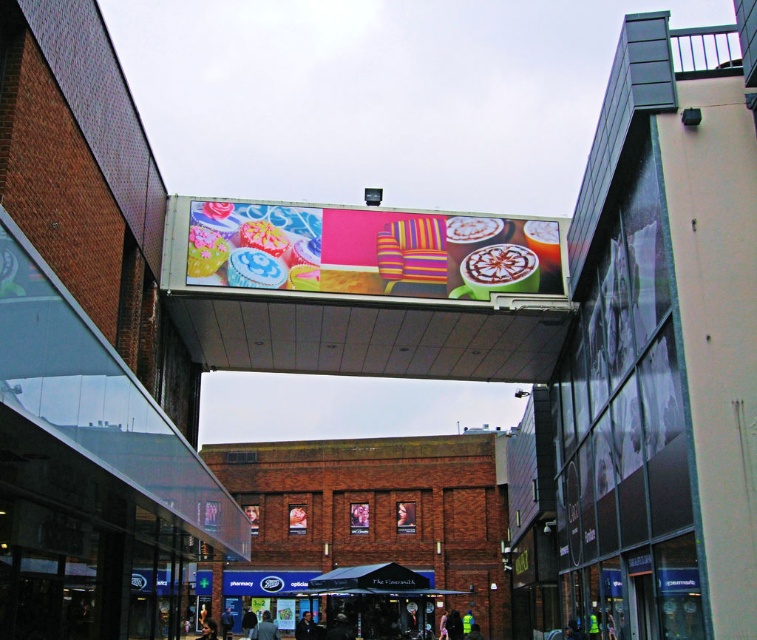
Question: Which object is farther from the camera taking this photo?

Choices:
 (A) dark brown hair at center
 (B) dark blue jacket at center
 (C) black fabric canopy at center

Answer: (A)

Question: Among these objects, which one is nearest to the camera?

Choices:
 (A) dark brown hair at center
 (B) dark blue jacket at center
 (C) vibrant digital billboard at center

Answer: (C)

Question: Which of the following is the closest to the observer?

Choices:
 (A) light blue denim jacket at center
 (B) dark blue jacket at center
 (C) dark brown hair at center

Answer: (A)

Question: Can you confirm if black fabric canopy at center is positioned below dark brown hair at center?

Choices:
 (A) no
 (B) yes

Answer: (A)

Question: Can you confirm if black fabric canopy at center is bigger than dark brown hair at center?

Choices:
 (A) no
 (B) yes

Answer: (B)

Question: Can you confirm if vibrant digital billboard at center is bigger than black fabric canopy at center?

Choices:
 (A) yes
 (B) no

Answer: (B)